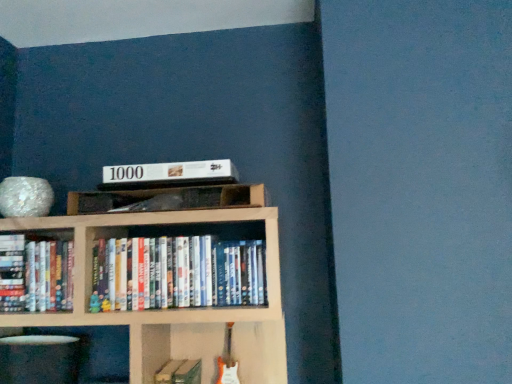
Question: In which direction should I rotate to look at wooden shelf at center, which is the first shelf from right to left?

Choices:
 (A) left
 (B) right

Answer: (A)

Question: Which direction should I rotate to look at hardcover book at center, which appears as the 2th book when viewed from the left?

Choices:
 (A) left
 (B) right

Answer: (A)

Question: Does white glossy plate at lower left, which ranks as the 1th shelf in bottom-to-top order, have a greater width compared to white matte book at upper center?

Choices:
 (A) no
 (B) yes

Answer: (A)

Question: Is white glossy plate at lower left, which ranks as the 1th shelf in bottom-to-top order, to the left of white matte book at upper center from the viewer's perspective?

Choices:
 (A) no
 (B) yes

Answer: (B)

Question: Is white glossy plate at lower left, which ranks as the 1th shelf in bottom-to-top order, aimed at white matte book at upper center?

Choices:
 (A) yes
 (B) no

Answer: (B)

Question: Can you confirm if white glossy plate at lower left, which ranks as the 1th shelf in bottom-to-top order, is smaller than white matte book at upper center?

Choices:
 (A) yes
 (B) no

Answer: (B)

Question: Is the depth of white glossy plate at lower left, positioned as the second shelf in top-to-bottom order, less than that of white matte book at upper center?

Choices:
 (A) no
 (B) yes

Answer: (B)

Question: Does white glossy plate at lower left, positioned as the second shelf in top-to-bottom order, have a lesser height compared to white matte book at upper center?

Choices:
 (A) yes
 (B) no

Answer: (B)

Question: Does white glossy plate at lower left, marked as the 2th shelf in a right-to-left arrangement, have a greater width compared to hardcover books at left, placed as the third book when sorted from right to left?

Choices:
 (A) yes
 (B) no

Answer: (A)

Question: Considering the relative positions of white glossy plate at lower left, marked as the 2th shelf in a right-to-left arrangement, and hardcover books at left, positioned as the 1th book in left-to-right order, in the image provided, is white glossy plate at lower left, marked as the 2th shelf in a right-to-left arrangement, to the left of hardcover books at left, positioned as the 1th book in left-to-right order, from the viewer's perspective?

Choices:
 (A) yes
 (B) no

Answer: (B)

Question: Is white glossy plate at lower left, placed as the 1th shelf when sorted from left to right, outside of hardcover books at left, positioned as the 1th book in left-to-right order?

Choices:
 (A) yes
 (B) no

Answer: (A)

Question: From a real-world perspective, does white glossy plate at lower left, positioned as the second shelf in top-to-bottom order, stand above hardcover books at left, placed as the third book when sorted from right to left?

Choices:
 (A) no
 (B) yes

Answer: (A)

Question: Can you confirm if white glossy plate at lower left, marked as the 2th shelf in a right-to-left arrangement, is shorter than hardcover books at left, positioned as the 1th book in left-to-right order?

Choices:
 (A) no
 (B) yes

Answer: (B)

Question: Is white glossy plate at lower left, placed as the 1th shelf when sorted from left to right, to the right of hardcover books at left, positioned as the 1th book in left-to-right order, from the viewer's perspective?

Choices:
 (A) no
 (B) yes

Answer: (B)

Question: Is hardcover books at left, the 2th book in the top-to-bottom sequence, facing away from white glossy dvds at center, positioned as the third book in left-to-right order?

Choices:
 (A) no
 (B) yes

Answer: (A)